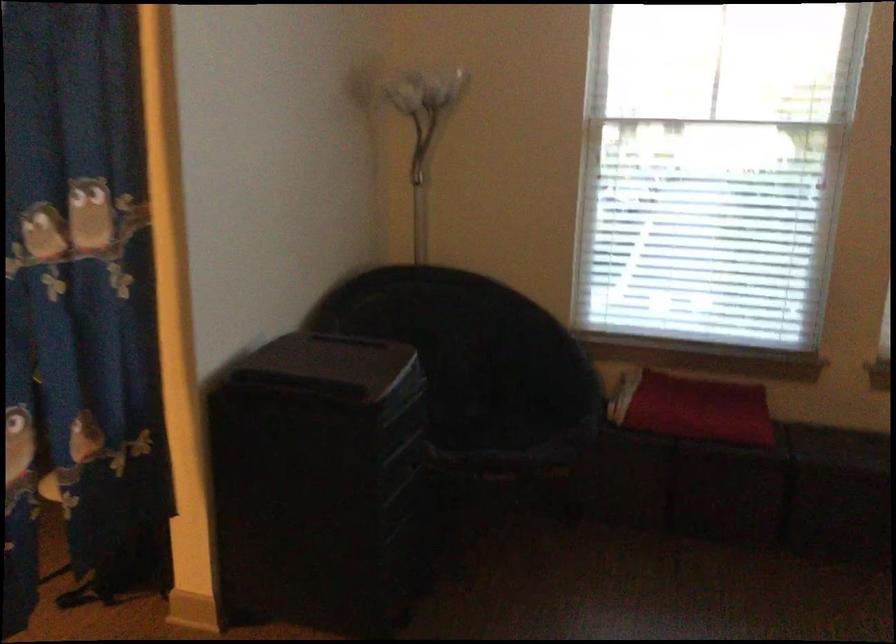
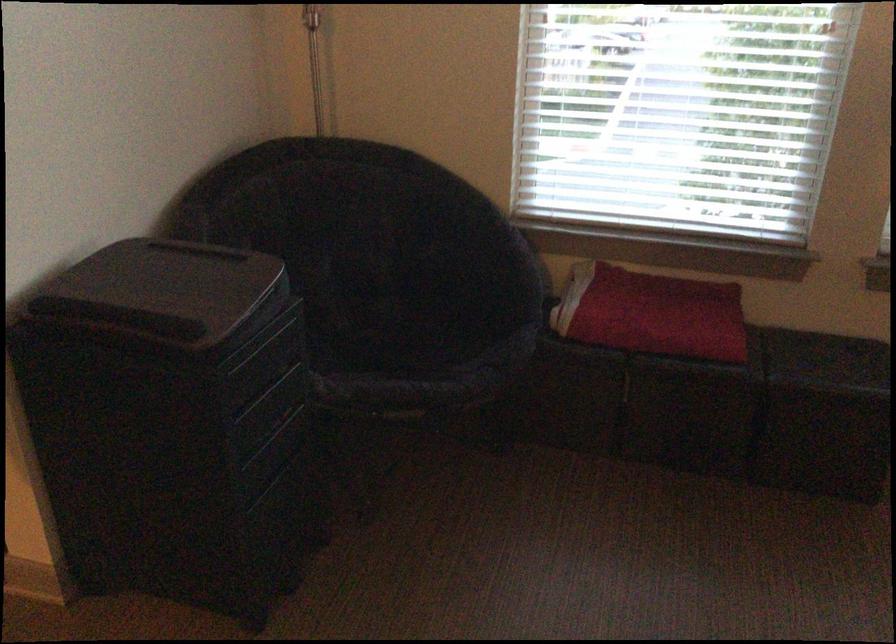
Find the pixel in the second image that matches [478,430] in the first image.

(393, 339)